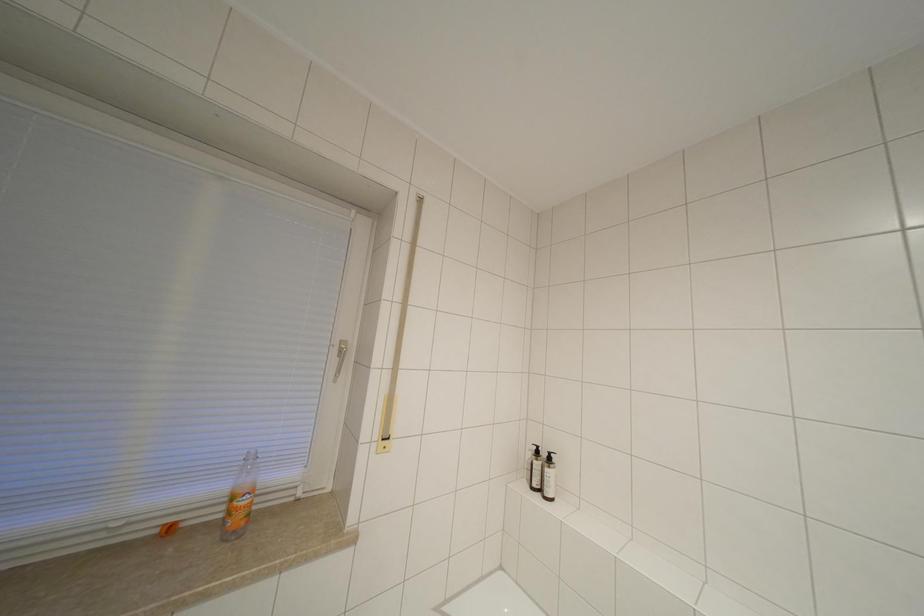
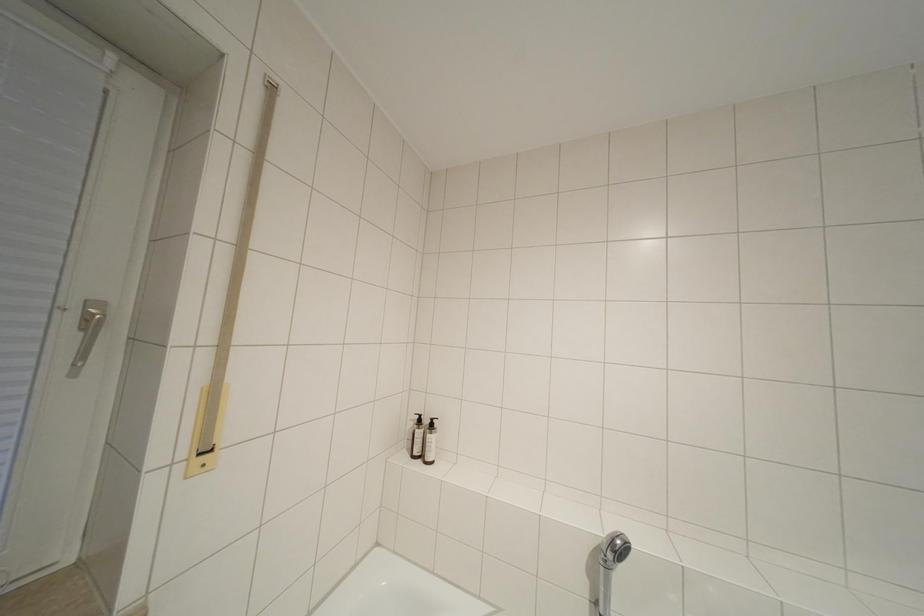
Question: The images are taken continuously from a first-person perspective. In which direction are you moving?

Choices:
 (A) Left
 (B) Right
 (C) Forward
 (D) Backward

Answer: (C)